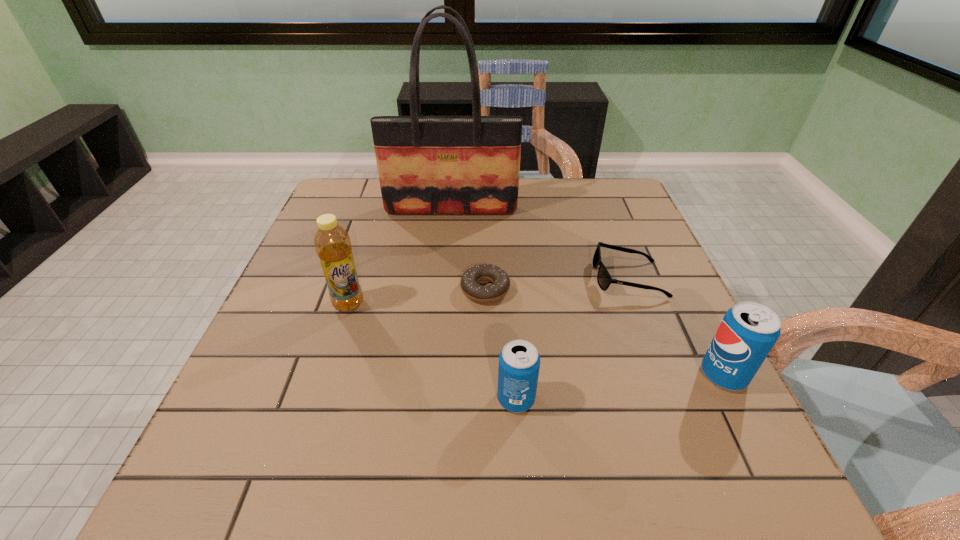
Find the location of a particular element. This screenshot has width=960, height=540. free point that keeps the soda cans evenly spaced on the left is located at coordinates (287, 425).